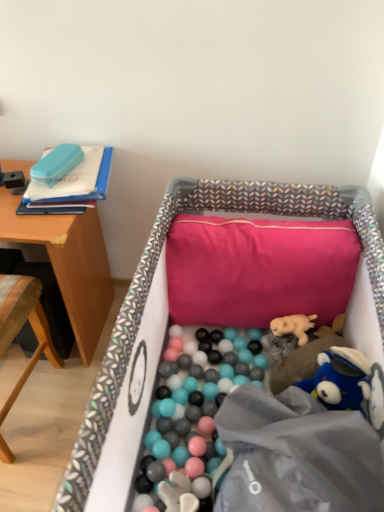
Question: Can you confirm if wooden chair at left is positioned to the left of fluffy beige stuffed animal at center-right, acting as the 3th toy starting from the left?

Choices:
 (A) no
 (B) yes

Answer: (B)

Question: Does wooden chair at left have a lesser height compared to fluffy beige stuffed animal at center-right, positioned as the third toy in top-to-bottom order?

Choices:
 (A) no
 (B) yes

Answer: (A)

Question: From a real-world perspective, is wooden chair at left physically above fluffy beige stuffed animal at center-right, which appears as the first toy when viewed from the right?

Choices:
 (A) no
 (B) yes

Answer: (B)

Question: Is wooden chair at left outside fluffy beige stuffed animal at center-right, positioned as the third toy in top-to-bottom order?

Choices:
 (A) yes
 (B) no

Answer: (A)

Question: Considering the relative positions of wooden chair at left and fluffy beige stuffed animal at center-right, positioned as the third toy in top-to-bottom order, in the image provided, is wooden chair at left in front of fluffy beige stuffed animal at center-right, positioned as the third toy in top-to-bottom order,?

Choices:
 (A) yes
 (B) no

Answer: (A)

Question: Considering the relative positions of fluffy beige plush at center, which is the second toy from left to right, and matte blue pencil case at upper left, which is counted as the first toy, starting from the left, in the image provided, is fluffy beige plush at center, which is the second toy from left to right, to the left or to the right of matte blue pencil case at upper left, which is counted as the first toy, starting from the left,?

Choices:
 (A) right
 (B) left

Answer: (A)

Question: Is fluffy beige plush at center, which is counted as the second toy, starting from the right, inside or outside of matte blue pencil case at upper left, which is counted as the first toy, starting from the left?

Choices:
 (A) outside
 (B) inside

Answer: (A)

Question: Is fluffy beige plush at center, which is the second toy from left to right, bigger or smaller than matte blue pencil case at upper left, the 3th toy from the bottom?

Choices:
 (A) big
 (B) small

Answer: (B)

Question: From the image's perspective, is fluffy beige plush at center, which appears as the 2th toy when viewed from the top, positioned above or below matte blue pencil case at upper left, the 3th toy from the bottom?

Choices:
 (A) above
 (B) below

Answer: (B)

Question: In terms of height, does wooden chair at left look taller or shorter compared to matte blue pencil case at upper left, the 3th toy from the bottom?

Choices:
 (A) tall
 (B) short

Answer: (A)

Question: Would you say wooden chair at left is inside or outside matte blue pencil case at upper left, the 3th toy from the bottom?

Choices:
 (A) inside
 (B) outside

Answer: (B)

Question: From the image's perspective, relative to matte blue pencil case at upper left, which appears as the 1th toy when viewed from the top, is wooden chair at left above or below?

Choices:
 (A) below
 (B) above

Answer: (A)

Question: From a real-world perspective, relative to matte blue pencil case at upper left, which appears as the 1th toy when viewed from the top, is wooden chair at left vertically above or below?

Choices:
 (A) below
 (B) above

Answer: (A)

Question: Considering the positions of fabric-lined crib at center and fluffy beige stuffed animal at center-right, positioned as the third toy in top-to-bottom order, in the image, is fabric-lined crib at center wider or thinner than fluffy beige stuffed animal at center-right, positioned as the third toy in top-to-bottom order,?

Choices:
 (A) thin
 (B) wide

Answer: (B)

Question: Would you say fabric-lined crib at center is inside or outside fluffy beige stuffed animal at center-right, acting as the 3th toy starting from the left?

Choices:
 (A) outside
 (B) inside

Answer: (A)